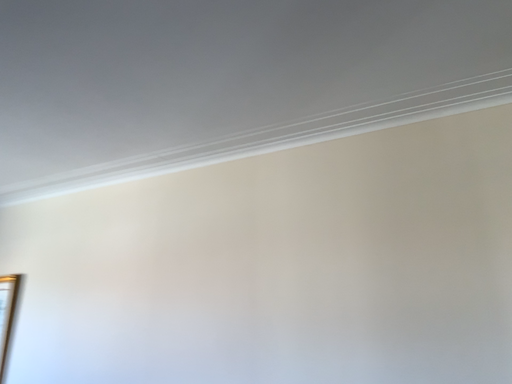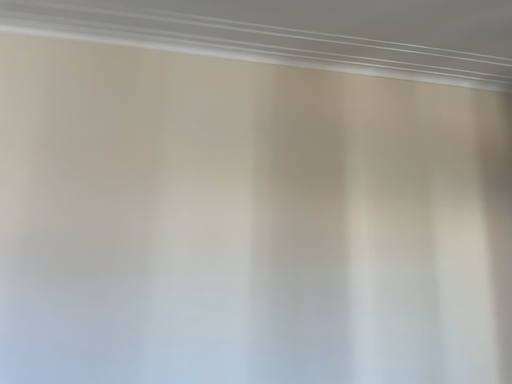
Question: How did the camera likely rotate when shooting the video?

Choices:
 (A) rotated right
 (B) rotated left

Answer: (A)